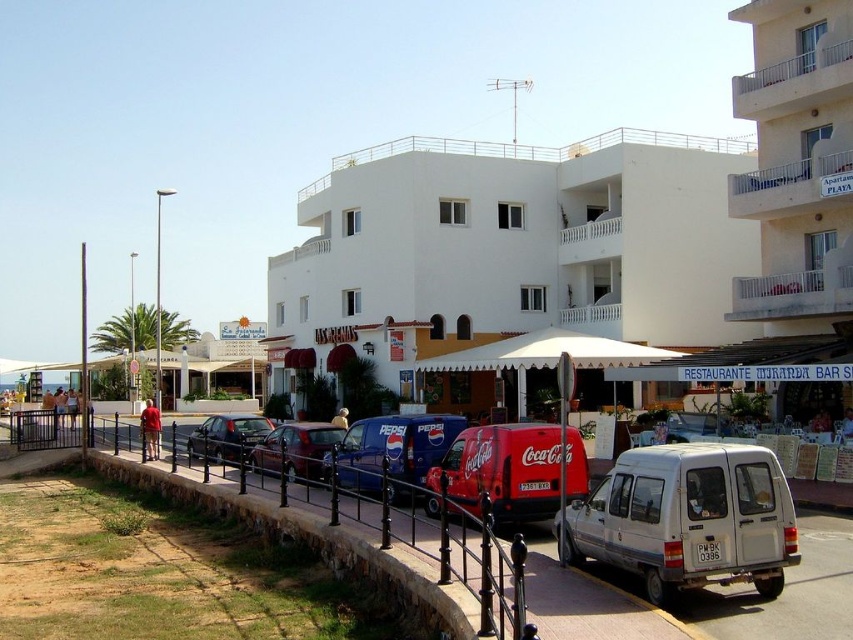
Is blue metallic van at center thinner than shiny black sedan at center?

Yes.

Is blue metallic van at center wider than shiny black sedan at center?

No, blue metallic van at center is not wider than shiny black sedan at center.

I want to click on blue metallic van at center, so click(x=393, y=449).

The width and height of the screenshot is (853, 640). Find the location of `blue metallic van at center`. blue metallic van at center is located at coordinates (393, 449).

Does silver metallic van at center have a larger size compared to metallic red van at center?

Indeed, silver metallic van at center has a larger size compared to metallic red van at center.

Does silver metallic van at center have a greater height compared to metallic red van at center?

Correct, silver metallic van at center is much taller as metallic red van at center.

Is point (770, 483) less distant than point (289, 467)?

Yes, it is.

Identify the location of silver metallic van at center. point(688,518).

Based on the photo, between beige concrete building at center and silver metallic van at center, which one has less height?

silver metallic van at center

Does beige concrete building at center come in front of silver metallic van at center?

That is False.

The image size is (853, 640). I want to click on beige concrete building at center, so click(x=798, y=172).

Find the location of a particular element. Image resolution: width=853 pixels, height=640 pixels. beige concrete building at center is located at coordinates (798, 172).